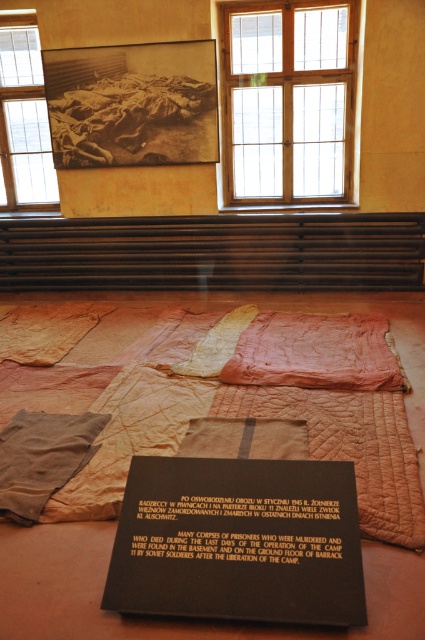
You are a visitor at the museum and want to compare the sizes of the yellowed paper photograph at upper center and the clear glass window at upper left. Based on the scene description, which object is taller?

The yellowed paper photograph at upper center is not as tall as the clear glass window at upper left, so the clear glass window at upper left is taller.

You are a historian examining the Holocaust exhibit. You notice the quilted fabric bed at center. Where is it positioned in relation to the black plaque with gold text?

The quilted fabric bed at center is located at point [167,620], which is to the right of the black plaque with gold text.

You are a visitor at the museum and you want to take a photo of the black plaque with gold text. However, there is a point at coordinates (23, 118) on clear glass window at upper left. Will this point block your view of the plaque?

The point at coordinates (23, 118) on clear glass window at upper left is located on the clear glass window at upper left, so it will not block your view of the black plaque with gold text as it is on a separate window area.